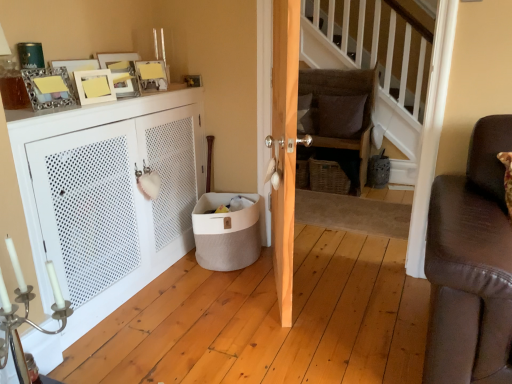
In the scene shown: In order to face wooden staircase at center, should I rotate leftwards or rightwards?

You should rotate right by 12.650 degrees.

Where is `matte yellow picture frame at upper left, acting as the 2th picture frame starting from the left`? The image size is (512, 384). matte yellow picture frame at upper left, acting as the 2th picture frame starting from the left is located at coordinates (94, 86).

What is the approximate width of matte gold picture frame at upper left, acting as the 1th picture frame starting from the left?

1.97 inches.

Measure the distance between silver metallic candle holder at lower left and camera.

silver metallic candle holder at lower left and camera are 4.15 feet apart from each other.

You are a GUI agent. You are given a task and a screenshot of the screen. Output one action in this format:
    pyautogui.click(x=<x>, y=<y>)
    Task: Click on the brown fabric pillow at center, which appears as the first pillow when viewed from the right
    The height and width of the screenshot is (384, 512).
    Given the screenshot: What is the action you would take?
    pyautogui.click(x=340, y=115)

At what (x,y) coordinates should I click in order to perform the action: click on white matte cabinet at left. Please return your answer as a coordinate pair (x, y). Looking at the image, I should click on (108, 196).

Between textured brown cushion at center and velvet gray pillow at center, the first pillow positioned from the left, which one is positioned in front?

→ textured brown cushion at center is closer to the camera.

Which is more to the left, textured brown cushion at center or velvet gray pillow at center, the 2th pillow when ordered from right to left?

Positioned to the left is velvet gray pillow at center, the 2th pillow when ordered from right to left.

Can you confirm if textured brown cushion at center is wider than velvet gray pillow at center, the 2th pillow when ordered from right to left?

Yes.

Where is `chair on the right of velvet gray pillow at center, the 2th pillow when ordered from right to left`? The image size is (512, 384). chair on the right of velvet gray pillow at center, the 2th pillow when ordered from right to left is located at coordinates (341, 118).

From a real-world perspective, is white matte cabinet at left physically below textured brown cushion at center?

Yes, from a real-world perspective, white matte cabinet at left is under textured brown cushion at center.

Which point is more distant from viewer, (74, 309) or (334, 139)?

Positioned behind is point (334, 139).

Considering the sizes of objects white matte cabinet at left and textured brown cushion at center in the image provided, who is taller, white matte cabinet at left or textured brown cushion at center?

textured brown cushion at center is taller.

Does white matte cabinet at left touch textured brown cushion at center?

No, white matte cabinet at left is not touching textured brown cushion at center.

Which of these two, wooden door at center or woven brown basket at center, stands shorter?

woven brown basket at center is shorter.

From the picture: Considering the relative positions of wooden door at center and woven brown basket at center in the image provided, is wooden door at center to the left or to the right of woven brown basket at center?

wooden door at center is positioned on woven brown basket at center's left side.

Who is bigger, wooden door at center or woven brown basket at center?

wooden door at center.

Does wooden door at center contain woven brown basket at center?

No, woven brown basket at center is located outside of wooden door at center.

Could you measure the distance between metallic silver picture frame at upper center, marked as the first picture frame in a back-to-front arrangement, and metallic silver picture frame at upper left, which is counted as the third picture frame, starting from the front?

The distance of metallic silver picture frame at upper center, marked as the first picture frame in a back-to-front arrangement, from metallic silver picture frame at upper left, which is counted as the third picture frame, starting from the front, is 12.33 inches.

From a real-world perspective, which is physically below, metallic silver picture frame at upper center, marked as the first picture frame in a back-to-front arrangement, or metallic silver picture frame at upper left, which is the third picture frame in left-to-right order?

From a 3D spatial view, metallic silver picture frame at upper center, marked as the first picture frame in a back-to-front arrangement, is below.

Which of these two, metallic silver picture frame at upper center, which is the 4th picture frame in front-to-back order, or metallic silver picture frame at upper left, which is counted as the third picture frame, starting from the front, stands taller?

Standing taller between the two is metallic silver picture frame at upper left, which is counted as the third picture frame, starting from the front.

Considering the relative sizes of metallic silver picture frame at upper center, which is the 4th picture frame in front-to-back order, and metallic silver picture frame at upper left, which is the third picture frame in left-to-right order, in the image provided, is metallic silver picture frame at upper center, which is the 4th picture frame in front-to-back order, bigger than metallic silver picture frame at upper left, which is the third picture frame in left-to-right order,?

No.

Is matte yellow picture frame at upper left, which appears as the first picture frame when viewed from the front, at the back of wooden staircase at center?

No, matte yellow picture frame at upper left, which appears as the first picture frame when viewed from the front, is not at the back of wooden staircase at center.

Which is closer to the camera, (358, 42) or (91, 78)?

Point (91, 78)

From the image's perspective, which is below, wooden staircase at center or matte yellow picture frame at upper left, acting as the 2th picture frame starting from the left?

wooden staircase at center, from the image's perspective.

Can you confirm if wooden staircase at center is smaller than matte yellow picture frame at upper left, the 4th picture frame when ordered from back to front?

No, wooden staircase at center is not smaller than matte yellow picture frame at upper left, the 4th picture frame when ordered from back to front.

Is wooden staircase at center thinner than brown fabric pillow at center, marked as the 2th pillow in a left-to-right arrangement?

No, wooden staircase at center is not thinner than brown fabric pillow at center, marked as the 2th pillow in a left-to-right arrangement.

Based on their sizes in the image, would you say wooden staircase at center is bigger or smaller than brown fabric pillow at center, marked as the 2th pillow in a left-to-right arrangement?

wooden staircase at center is bigger than brown fabric pillow at center, marked as the 2th pillow in a left-to-right arrangement.

From the image's perspective, between wooden staircase at center and brown fabric pillow at center, which appears as the first pillow when viewed from the right, which one is located above?

brown fabric pillow at center, which appears as the first pillow when viewed from the right.

This screenshot has width=512, height=384. I want to click on stairwell lying in front of the brown fabric pillow at center, marked as the 2th pillow in a left-to-right arrangement, so click(374, 59).

From the picture: Considering the sizes of wooden staircase at center and metallic silver picture frame at upper left, the 2th picture frame when ordered from back to front, in the image, is wooden staircase at center bigger or smaller than metallic silver picture frame at upper left, the 2th picture frame when ordered from back to front,?

Clearly, wooden staircase at center is larger in size than metallic silver picture frame at upper left, the 2th picture frame when ordered from back to front.

Looking at their sizes, would you say wooden staircase at center is wider or thinner than metallic silver picture frame at upper left, the 2th picture frame when ordered from back to front?

Clearly, wooden staircase at center has more width compared to metallic silver picture frame at upper left, the 2th picture frame when ordered from back to front.

Is wooden staircase at center surrounding metallic silver picture frame at upper left, the 2th picture frame when ordered from back to front?

No, metallic silver picture frame at upper left, the 2th picture frame when ordered from back to front, is not surrounded by wooden staircase at center.

Is wooden staircase at center closer to camera compared to metallic silver picture frame at upper left, the 2th picture frame when ordered from back to front?

Yes, the depth of wooden staircase at center is less than that of metallic silver picture frame at upper left, the 2th picture frame when ordered from back to front.

What are the coordinates of `chair below the velvet gray pillow at center, the 2th pillow when ordered from right to left (from a real-world perspective)` in the screenshot? It's located at (x=341, y=118).

At what (x,y) coordinates should I click in order to perform the action: click on chair above the white matte cabinet at left (from the image's perspective). Please return your answer as a coordinate pair (x, y). Looking at the image, I should click on (341, 118).

From the image, which object appears to be farther from brown fabric pillow at center, marked as the 2th pillow in a left-to-right arrangement, textured brown cushion at center or metallic silver picture frame at upper left, the 2th picture frame when ordered from back to front?

metallic silver picture frame at upper left, the 2th picture frame when ordered from back to front, is further to brown fabric pillow at center, marked as the 2th pillow in a left-to-right arrangement.

Estimate the real-world distances between objects in this image. Which object is further from velvet gray pillow at center, the 2th pillow when ordered from right to left, woven brown basket at center or textured brown cushion at center?

Based on the image, woven brown basket at center appears to be further to velvet gray pillow at center, the 2th pillow when ordered from right to left.

Estimate the real-world distances between objects in this image. Which object is further from metallic silver picture frame at upper left, which is the third picture frame in left-to-right order, velvet gray pillow at center, the 2th pillow when ordered from right to left, or woven brown basket at center?

The object further to metallic silver picture frame at upper left, which is the third picture frame in left-to-right order, is woven brown basket at center.

Looking at the image, which one is located further to velvet gray pillow at center, the first pillow positioned from the left, matte gold picture frame at upper left, the third picture frame viewed from the back, or metallic silver picture frame at upper center, which is counted as the first picture frame, starting from the right?

matte gold picture frame at upper left, the third picture frame viewed from the back, is positioned further to the anchor velvet gray pillow at center, the first pillow positioned from the left.

Which object lies further to the anchor point woven brown basket at center, textured brown cushion at center or silver metallic candle holder at lower left?

silver metallic candle holder at lower left lies further to woven brown basket at center than the other object.

From the image, which object appears to be farther from metallic silver picture frame at upper center, arranged as the 4th picture frame when viewed from the left, matte gold picture frame at upper left, the third picture frame viewed from the back, or woven brown basket at center?

woven brown basket at center is positioned further to the anchor metallic silver picture frame at upper center, arranged as the 4th picture frame when viewed from the left.

Which object lies further to the anchor point white matte cabinet at left, woven brown basket at center or metallic silver picture frame at upper left, which is counted as the third picture frame, starting from the front?

The object further to white matte cabinet at left is woven brown basket at center.

Considering their positions, is matte gold picture frame at upper left, placed as the 2th picture frame when sorted from front to back, positioned closer to woven brown basket at center than wooden door at center?

Based on the image, wooden door at center appears to be nearer to woven brown basket at center.

The image size is (512, 384). Find the location of `door between white matte cabinet at left and metallic silver picture frame at upper center, arranged as the 4th picture frame when viewed from the left, in the front-back direction`. door between white matte cabinet at left and metallic silver picture frame at upper center, arranged as the 4th picture frame when viewed from the left, in the front-back direction is located at coordinates [x=284, y=147].

Locate an element on the screen. The image size is (512, 384). stairwell between white matte cabinet at left and velvet gray pillow at center, the 2th pillow when ordered from right to left, from front to back is located at coordinates (374, 59).

Image resolution: width=512 pixels, height=384 pixels. Identify the location of stairwell between white matte cabinet at left and brown fabric pillow at center, marked as the 2th pillow in a left-to-right arrangement, along the z-axis. (374, 59).

Find the location of a particular element. chair between wooden door at center and velvet gray pillow at center, the 2th pillow when ordered from right to left, in the front-back direction is located at coordinates (341, 118).